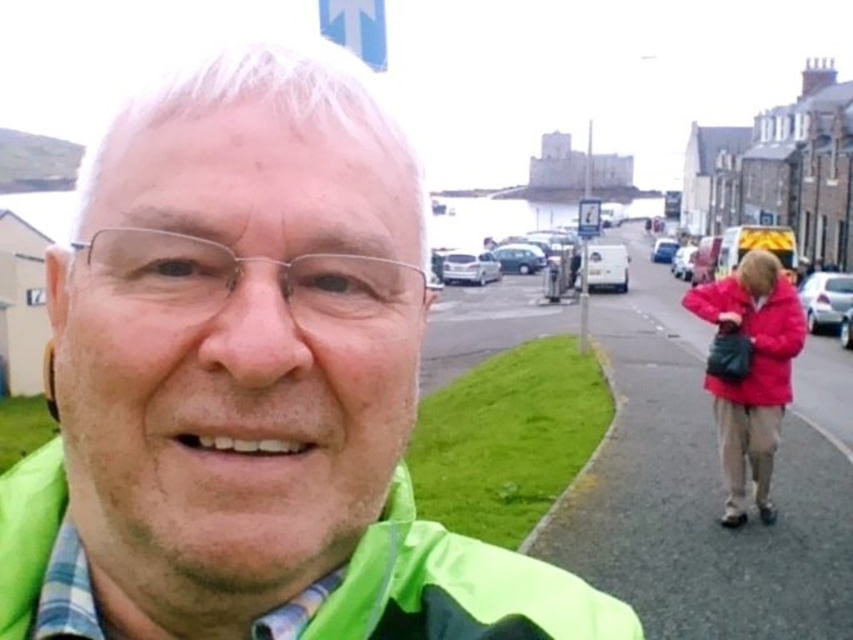
Does green fabric jacket at center have a greater height compared to green fabric jacket at lower left?

Yes.

Consider the image. Who is lower down, green fabric jacket at center or green fabric jacket at lower left?

green fabric jacket at lower left

Between point (112, 532) and point (364, 548), which one is positioned in front?

Point (112, 532) is more forward.

The image size is (853, 640). Find the location of `green fabric jacket at center`. green fabric jacket at center is located at coordinates (251, 385).

Is green fabric jacket at lower left shorter than matte red jacket at lower right?

Yes.

The width and height of the screenshot is (853, 640). What are the coordinates of `green fabric jacket at lower left` in the screenshot? It's located at (457, 588).

Which is behind, point (387, 545) or point (775, 320)?

Positioned behind is point (775, 320).

Is point (279, 173) positioned behind point (782, 285)?

No, (279, 173) is in front of (782, 285).

Locate an element on the screen. green fabric jacket at center is located at coordinates (251, 385).